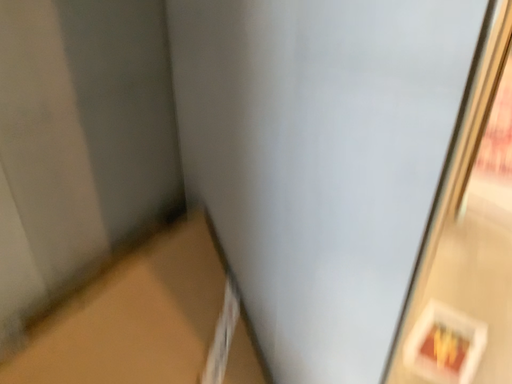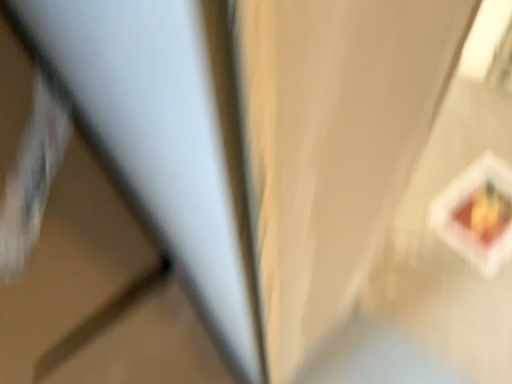
Question: Which way did the camera rotate in the video?

Choices:
 (A) rotated upward
 (B) rotated downward

Answer: (B)